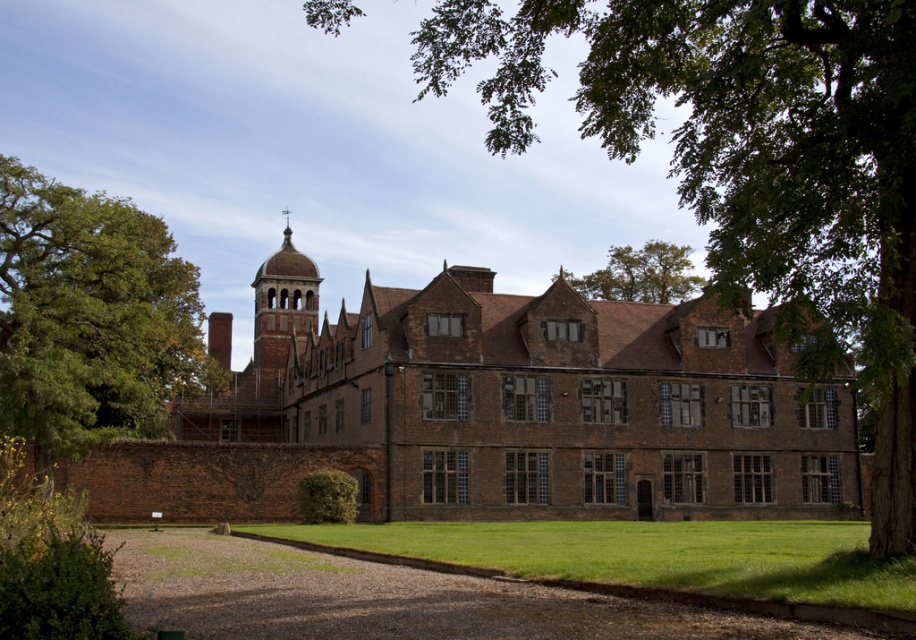
Which of these two, green leafy tree at upper right or green leafy tree at left, stands taller?

green leafy tree at upper right

Is green leafy tree at upper right thinner than green leafy tree at left?

Incorrect, green leafy tree at upper right's width is not less than green leafy tree at left's.

Does point (740, 186) come farther from viewer compared to point (78, 323)?

No.

At what (x,y) coordinates should I click in order to perform the action: click on green leafy tree at upper right. Please return your answer as a coordinate pair (x, y). Looking at the image, I should click on (751, 164).

Which of these two, green leafy tree at upper right or green leafy tree at upper center, stands shorter?

green leafy tree at upper center

Who is higher up, green leafy tree at upper right or green leafy tree at upper center?

Positioned higher is green leafy tree at upper right.

Is point (529, 28) in front of point (662, 282)?

Yes, it is in front of point (662, 282).

What are the coordinates of `green leafy tree at upper right` in the screenshot? It's located at (751, 164).

How much distance is there between green leafy tree at left and green leafy tree at upper center?

215.05 feet

Does green leafy tree at left have a lesser height compared to green leafy tree at upper center?

No, green leafy tree at left is not shorter than green leafy tree at upper center.

Identify the location of green leafy tree at left. (90, 317).

The height and width of the screenshot is (640, 916). I want to click on green leafy tree at left, so click(x=90, y=317).